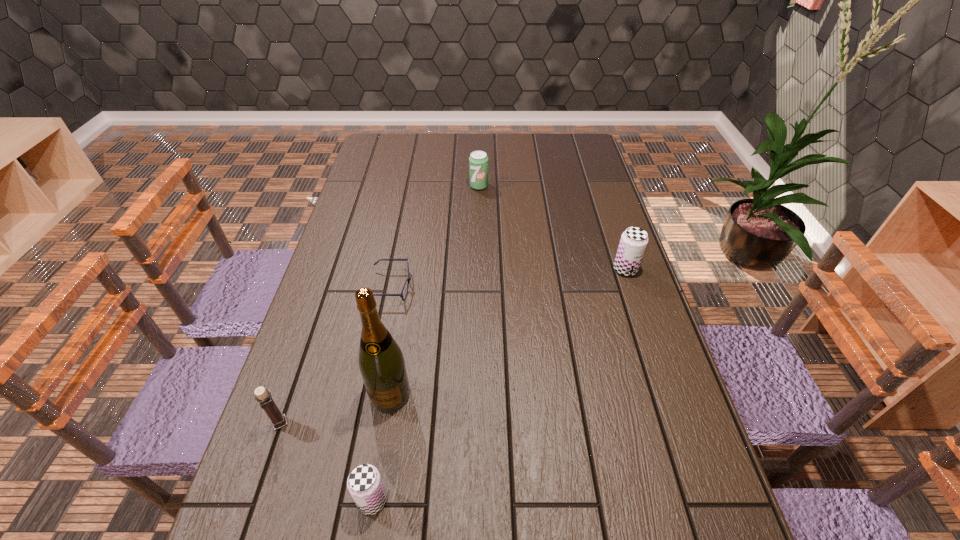
At what (x,y) coordinates should I click in order to perform the action: click on the fourth farthest object. Please return your answer as a coordinate pair (x, y). The image size is (960, 540). Looking at the image, I should click on (381, 362).

At what (x,y) coordinates should I click in order to perform the action: click on vacant space located on the right of the nearer beer can. Please return your answer as a coordinate pair (x, y). This screenshot has width=960, height=540. Looking at the image, I should click on (532, 500).

I want to click on free location located on the back of the farther beer can, so click(x=605, y=208).

The width and height of the screenshot is (960, 540). In order to click on vacant space situated 0.360m on the right of the soda in this screenshot , I will do `click(587, 186)`.

This screenshot has width=960, height=540. I want to click on free space located 0.060m on the front-facing side of the shortest object, so pos(433,287).

Identify the location of vacant position located 0.340m on the right of the fifth farthest object. (444, 423).

Locate an element on the screen. The image size is (960, 540). vacant space situated on the front-facing side of the third nearest object is located at coordinates (378, 468).

Find the location of a particular element. This screenshot has height=540, width=960. object positioned at the near edge is located at coordinates (364, 483).

This screenshot has height=540, width=960. I want to click on spectacles positioned at the left edge, so click(x=408, y=279).

Locate an element on the screen. This screenshot has height=540, width=960. candle holder located at the left edge is located at coordinates (263, 396).